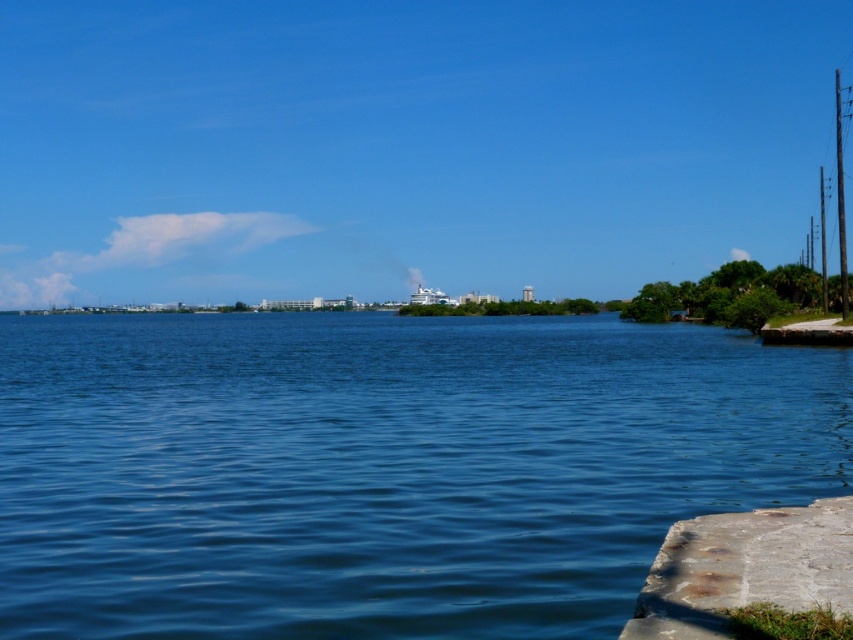
You are standing at the center of the image and want to walk towards the concrete at lower right. In which direction should you move relative to your current position?

You should move towards the lower right direction to reach the concrete at lower right.

You are standing on the concrete at lower right and want to walk towards the blue water at center. Which direction should you face to move directly towards it?

You should face to the left, as the blue water at center is located to the left of the concrete at lower right.